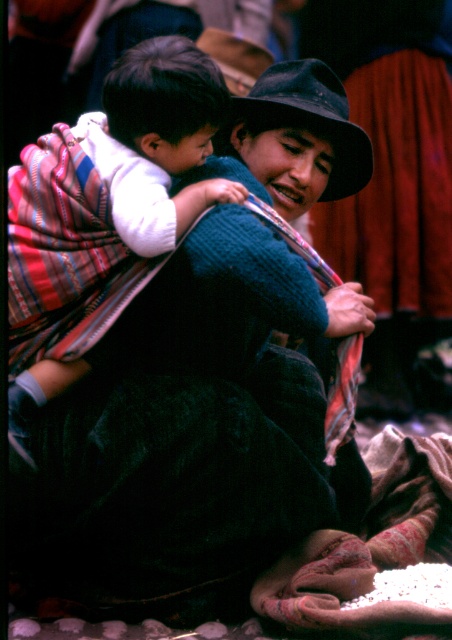
Question: Is white soft cloth at center to the left of black felt hat at upper center from the viewer's perspective?

Choices:
 (A) no
 (B) yes

Answer: (B)

Question: Which point is closer to the camera?

Choices:
 (A) knitted dark blue sweater at center
 (B) black felt hat at upper center

Answer: (A)

Question: Does knitted dark blue sweater at center have a larger size compared to black felt hat at upper center?

Choices:
 (A) yes
 (B) no

Answer: (A)

Question: Is knitted dark blue sweater at center positioned in front of black felt hat at upper center?

Choices:
 (A) no
 (B) yes

Answer: (B)

Question: Which point is closer to the camera taking this photo?

Choices:
 (A) (365, 132)
 (B) (117, 74)

Answer: (B)

Question: Which is nearer to the white soft cloth at center?

Choices:
 (A) knitted dark blue sweater at center
 (B) black felt hat at upper center

Answer: (A)